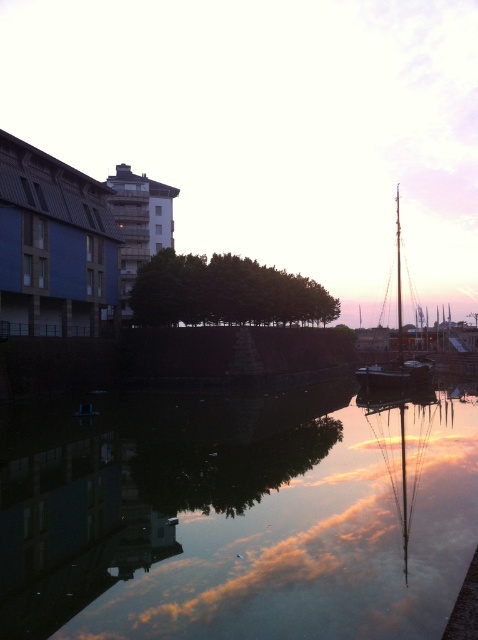
Question: Can you confirm if smooth reflective water at center is positioned to the right of wooden sailboat at right?

Choices:
 (A) yes
 (B) no

Answer: (B)

Question: Which point appears farthest from the camera in this image?

Choices:
 (A) (37, 625)
 (B) (364, 384)

Answer: (B)

Question: Is smooth reflective water at center closer to the viewer compared to wooden sailboat at right?

Choices:
 (A) no
 (B) yes

Answer: (B)

Question: Which point is farther to the camera?

Choices:
 (A) smooth reflective water at center
 (B) wooden sailboat at right

Answer: (B)

Question: Does smooth reflective water at center have a smaller size compared to wooden sailboat at right?

Choices:
 (A) no
 (B) yes

Answer: (B)

Question: Which of the following is the closest to the observer?

Choices:
 (A) wooden sailboat at right
 (B) smooth reflective water at center

Answer: (B)